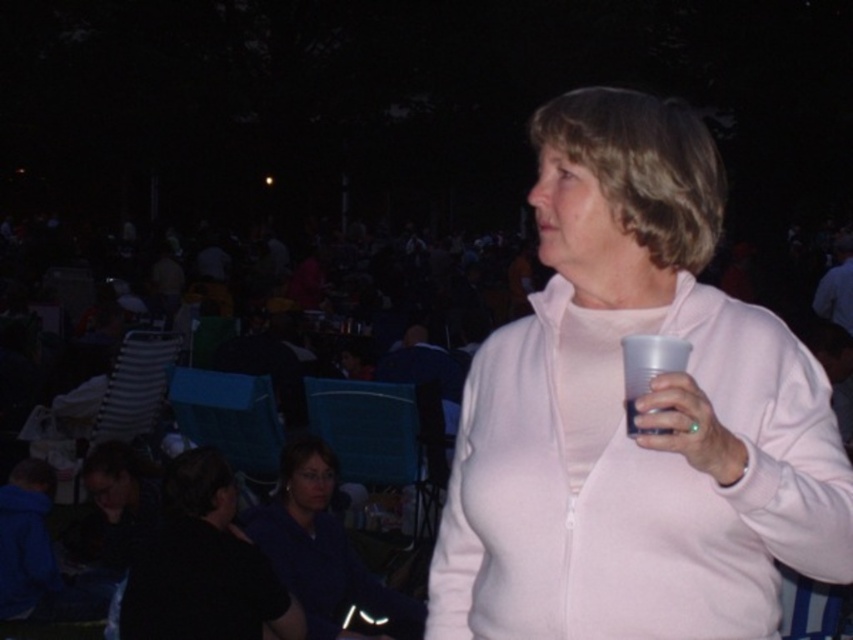
Question: Which object appears closest to the camera in this image?

Choices:
 (A) matte blue shirt at lower center
 (B) pink matte jacket at center
 (C) black matte shirt at lower left
 (D) translucent plastic cup at right

Answer: (B)

Question: Which point is closer to the camera taking this photo?

Choices:
 (A) (128, 612)
 (B) (624, 406)
 (C) (518, 582)

Answer: (B)

Question: Can you confirm if pink matte jacket at center is thinner than translucent plastic cup at right?

Choices:
 (A) no
 (B) yes

Answer: (A)

Question: Which object is positioned farthest from the black matte shirt at lower left?

Choices:
 (A) matte blue shirt at lower center
 (B) translucent plastic cup at right
 (C) pink matte jacket at center

Answer: (B)

Question: Does matte blue shirt at lower center have a larger size compared to translucent plastic cup at right?

Choices:
 (A) yes
 (B) no

Answer: (A)

Question: Can you confirm if pink matte jacket at center is positioned to the left of black matte shirt at lower left?

Choices:
 (A) yes
 (B) no

Answer: (B)